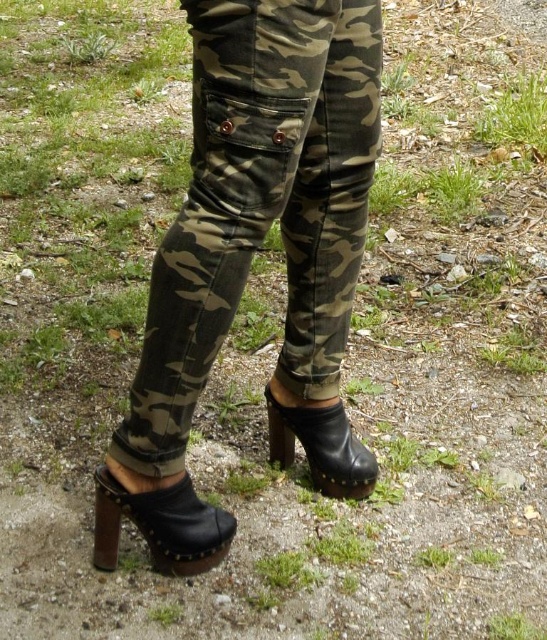
What are the coordinates of the camo fabric pants at center in the image?

The coordinates of the camo fabric pants at center are at point [260,205].

Looking at this image, you are a photographer setting up a shoot and need to adjust the lighting to ensure both the black leather sandal at lower left and the black leather boot at lower center are clearly visible. Based on their positions, which object should you focus the light on first to ensure it isn

The black leather sandal at lower left should be focused on first since it is in front of the black leather boot at lower center, so adjusting the light there will ensure both are visible without one blocking the other.